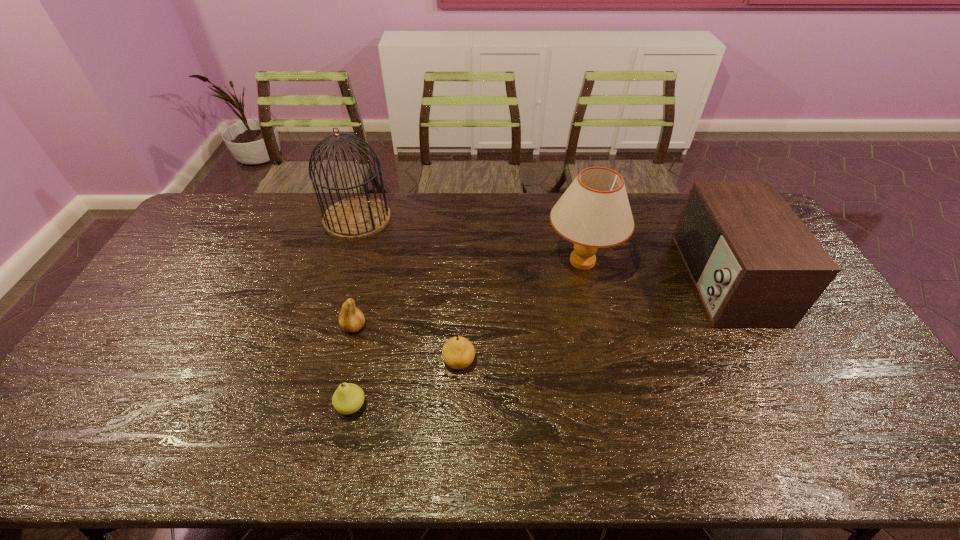
In the image, there is a desktop. Where is `vacant space at the right edge`? The image size is (960, 540). vacant space at the right edge is located at coordinates (858, 417).

In the image, there is a desktop. At what (x,y) coordinates should I click in order to perform the action: click on vacant space at the far left corner. Please return your answer as a coordinate pair (x, y). The width and height of the screenshot is (960, 540). Looking at the image, I should click on (242, 211).

At what (x,y) coordinates should I click in order to perform the action: click on vacant space at the near right corner. Please return your answer as a coordinate pair (x, y). Image resolution: width=960 pixels, height=540 pixels. Looking at the image, I should click on (886, 461).

Identify the location of free space between the fourth shortest object and the birdcage. This screenshot has height=540, width=960. (540, 248).

The height and width of the screenshot is (540, 960). What are the coordinates of `free spot between the farthest pear and the rightmost object` in the screenshot? It's located at click(x=539, y=302).

This screenshot has height=540, width=960. Find the location of `blank region between the rightmost object and the farthest pear`. blank region between the rightmost object and the farthest pear is located at coordinates (539, 302).

I want to click on vacant space that's between the rightmost object and the lampshade, so click(653, 270).

Where is `empty space that is in between the nearest pear and the farthest pear`? empty space that is in between the nearest pear and the farthest pear is located at coordinates (353, 366).

Locate an element on the screen. The width and height of the screenshot is (960, 540). free space that is in between the radio receiver and the farthest pear is located at coordinates (539, 302).

What are the coordinates of `unoccupied position between the nearest object and the fifth object from left to right` in the screenshot? It's located at (467, 334).